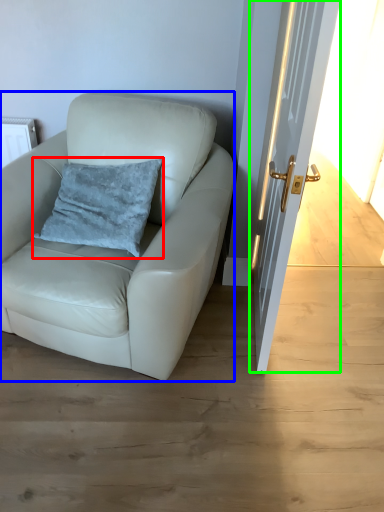
Question: Estimate the real-world distances between objects in this image. Which object is farther from pillow (highlighted by a red box), chair (highlighted by a blue box) or door (highlighted by a green box)?

Choices:
 (A) chair
 (B) door

Answer: (B)